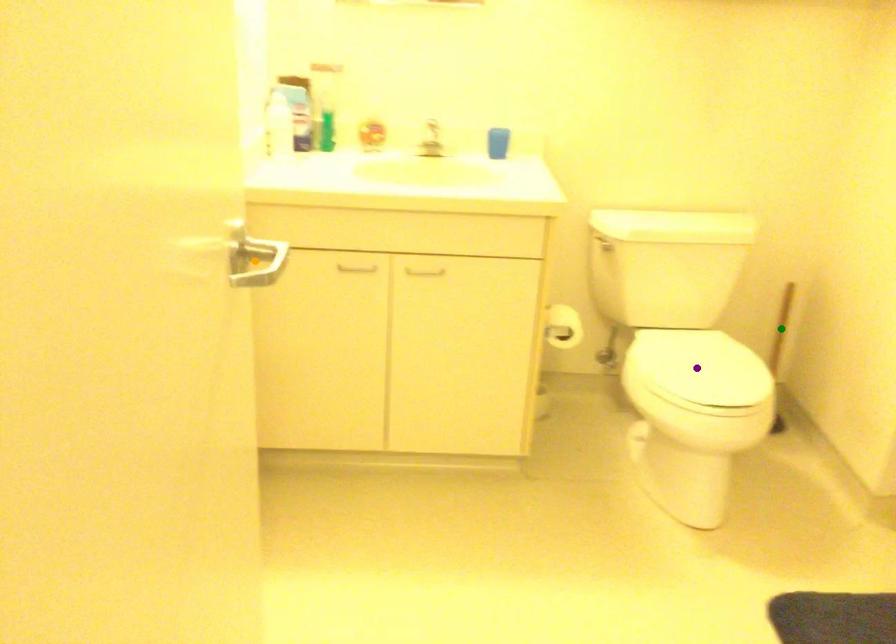
In the scene shown: Order these from nearest to farthest:
purple point | green point | orange point

orange point < purple point < green point